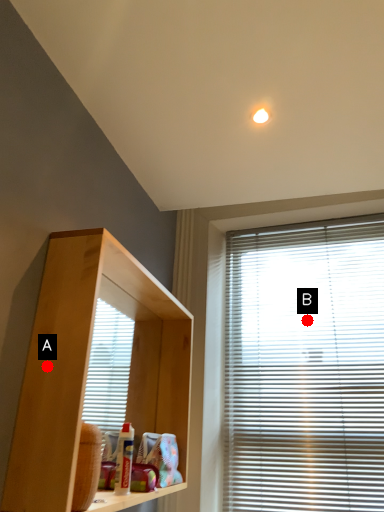
Question: Two points are circled on the image, labeled by A and B beside each circle. Which point appears farthest from the camera in this image?

Choices:
 (A) A is further
 (B) B is further

Answer: (B)